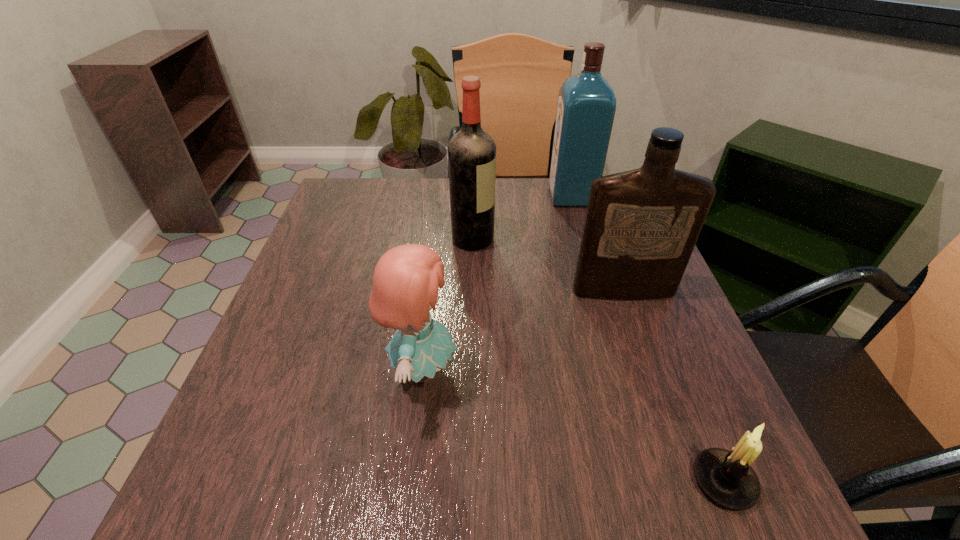
Identify the location of blank region between the fourth farthest object and the third farthest object. (x=522, y=329).

The width and height of the screenshot is (960, 540). Identify the location of object that is the third closest to the third farthest object. (586, 107).

The image size is (960, 540). What are the coordinates of `object that is the second closest one to the second farthest liquor` in the screenshot? It's located at (641, 226).

Find the location of a particular element. The image size is (960, 540). liquor that stands as the second closest to the farthest liquor is located at coordinates (641, 226).

Identify the location of liquor that is the second closest to the farthest liquor. (641, 226).

Where is `vacant space that satisfies the following two spatial constraints: 1. on the front-facing side of the doll; 2. on the left side of the candle holder`? The width and height of the screenshot is (960, 540). vacant space that satisfies the following two spatial constraints: 1. on the front-facing side of the doll; 2. on the left side of the candle holder is located at coordinates (409, 481).

At what (x,y) coordinates should I click in order to perform the action: click on vacant position in the image that satisfies the following two spatial constraints: 1. on the label side of the third farthest object; 2. on the front-facing side of the fourth farthest object. Please return your answer as a coordinate pair (x, y). Looking at the image, I should click on (651, 369).

The height and width of the screenshot is (540, 960). In order to click on vacant space that satisfies the following two spatial constraints: 1. on the back side of the candle holder; 2. on the front-facing side of the second nearest liquor in this screenshot , I will do `click(626, 239)`.

Locate an element on the screen. free space that satisfies the following two spatial constraints: 1. on the flat label side of the nearest object; 2. on the right side of the farthest liquor is located at coordinates (653, 481).